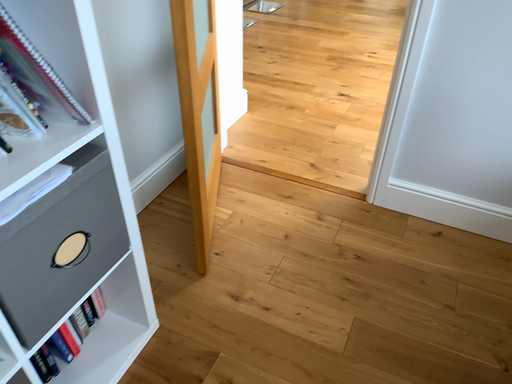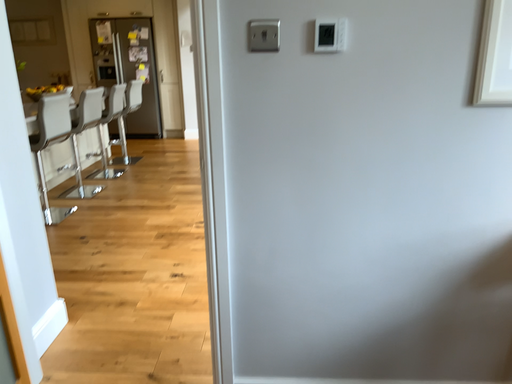
Question: Which way did the camera rotate in the video?

Choices:
 (A) rotated right
 (B) rotated left

Answer: (A)